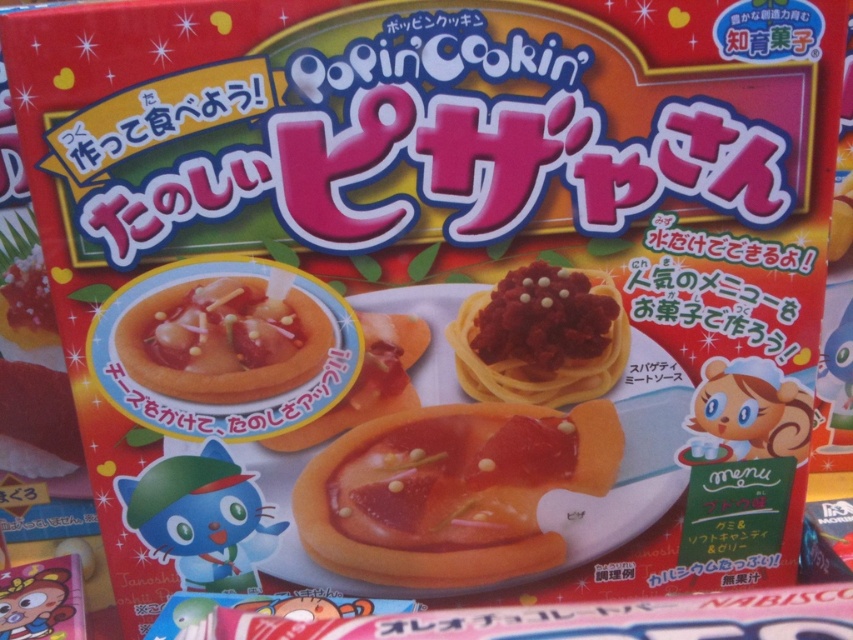
Question: Which object appears closest to the camera in this image?

Choices:
 (A) orange soft candy at center
 (B) matte plastic bowl at center-left

Answer: (B)

Question: Considering the real-world distances, which object is farthest from the matte red pasta at center?

Choices:
 (A) matte plastic bowl at center-left
 (B) orange soft candy at center

Answer: (A)

Question: Is the position of matte plastic bowl at center-left less distant than that of matte red pasta at center?

Choices:
 (A) no
 (B) yes

Answer: (B)

Question: Is orange soft candy at center thinner than matte plastic bowl at center-left?

Choices:
 (A) no
 (B) yes

Answer: (A)

Question: Is matte plastic bowl at center-left below matte red pasta at center?

Choices:
 (A) yes
 (B) no

Answer: (A)

Question: Which point appears farthest from the camera in this image?

Choices:
 (A) (160, 380)
 (B) (338, 525)

Answer: (B)